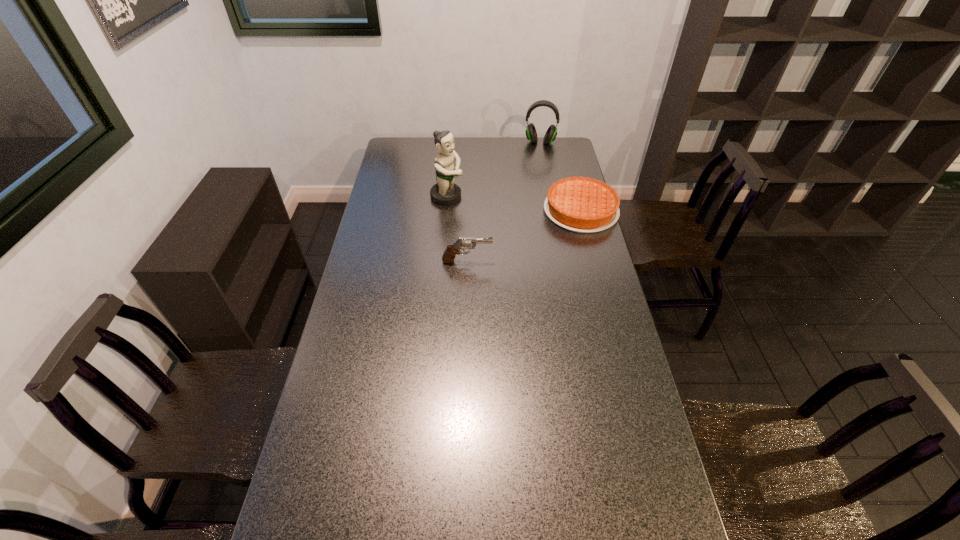
This screenshot has width=960, height=540. Identify the location of pistol. (463, 243).

The width and height of the screenshot is (960, 540). Identify the location of the nearest object. (463, 243).

You are a GUI agent. You are given a task and a screenshot of the screen. Output one action in this format:
    pyautogui.click(x=<x>, y=<y>)
    Task: Click on the pie
    Image resolution: width=960 pixels, height=540 pixels.
    Given the screenshot: What is the action you would take?
    pyautogui.click(x=580, y=204)

Locate an element on the screen. The width and height of the screenshot is (960, 540). the tallest object is located at coordinates (445, 191).

The height and width of the screenshot is (540, 960). What are the coordinates of `the second tallest object` in the screenshot? It's located at (x=531, y=134).

This screenshot has width=960, height=540. In order to click on the farthest object in this screenshot , I will do `click(531, 134)`.

Find the location of a particular element. This screenshot has width=960, height=540. free spot located 0.290m at the barrel of the second shortest object is located at coordinates (569, 261).

Locate an element on the screen. vacant space located on the back of the pie is located at coordinates (565, 150).

Locate an element on the screen. free location located on the front-facing side of the tallest object is located at coordinates (498, 217).

The width and height of the screenshot is (960, 540). In order to click on vacant space located on the front-facing side of the tallest object in this screenshot , I will do `click(504, 219)`.